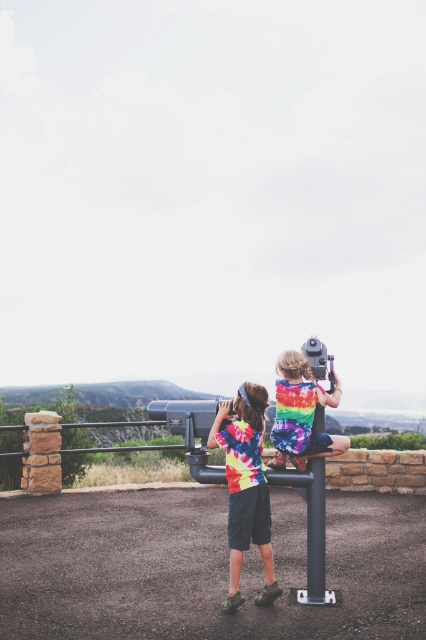
Question: Is tie-dye fabric shirt at center in front of tie-dye fabric at center?

Choices:
 (A) yes
 (B) no

Answer: (A)

Question: Observing the image, what is the correct spatial positioning of tie-dye fabric shirt at center in reference to tie-dye fabric at center?

Choices:
 (A) right
 (B) left

Answer: (B)

Question: Which of the following is the farthest from the observer?

Choices:
 (A) tie-dye fabric at center
 (B) tie-dye fabric shirt at center

Answer: (A)

Question: Is tie-dye fabric shirt at center behind tie-dye fabric at center?

Choices:
 (A) yes
 (B) no

Answer: (B)

Question: Which point appears farthest from the camera in this image?

Choices:
 (A) [x=285, y=451]
 (B) [x=235, y=580]

Answer: (A)